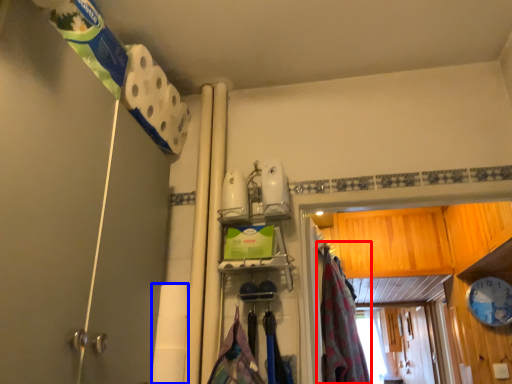
Question: Among these objects, which one is nearest to the camera, curtain (highlighted by a red box) or toilet paper (highlighted by a blue box)?

Choices:
 (A) curtain
 (B) toilet paper

Answer: (B)